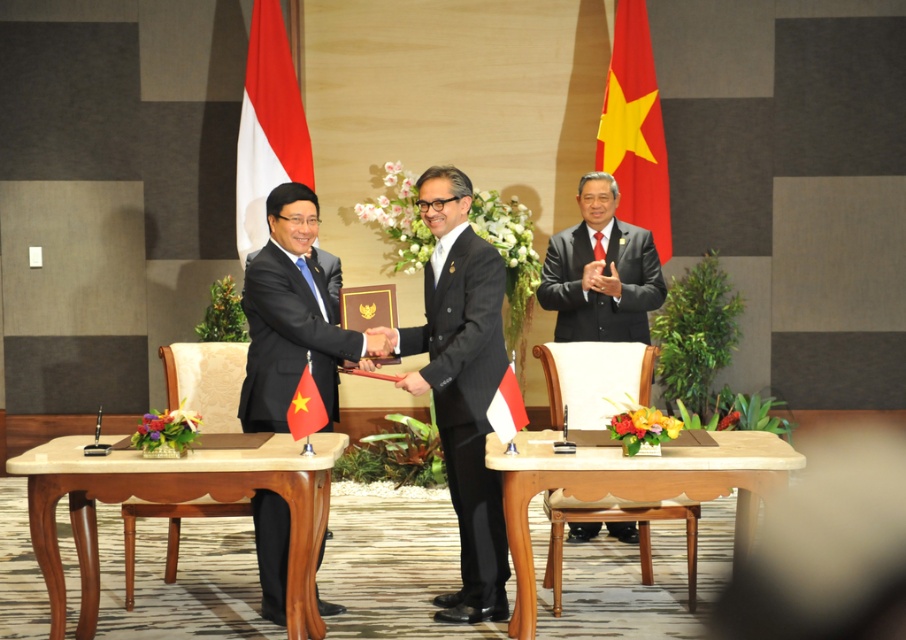
Is point (572, 257) closer to viewer compared to point (487, 410)?

No, it is not.

Can you confirm if dark gray suit at center is bigger than white and red striped flag at center?

Indeed, dark gray suit at center has a larger size compared to white and red striped flag at center.

Is point (638, 330) positioned after point (502, 426)?

That is True.

Identify the location of dark gray suit at center. (600, 272).

Does black satin suit at center appear on the right side of white fabric flag at left?

Correct, you'll find black satin suit at center to the right of white fabric flag at left.

Which is more to the left, black satin suit at center or white fabric flag at left?

From the viewer's perspective, white fabric flag at left appears more on the left side.

Is point (478, 509) farther from camera compared to point (278, 160)?

That is False.

Find the location of a particular element. The height and width of the screenshot is (640, 906). black satin suit at center is located at coordinates pos(461,385).

Based on the photo, which of these two, black glossy suit at center or red fabric flag at center, stands shorter?

Standing shorter between the two is red fabric flag at center.

Is black glossy suit at center above red fabric flag at center?

Yes.

Locate an element on the screen. black glossy suit at center is located at coordinates (292, 317).